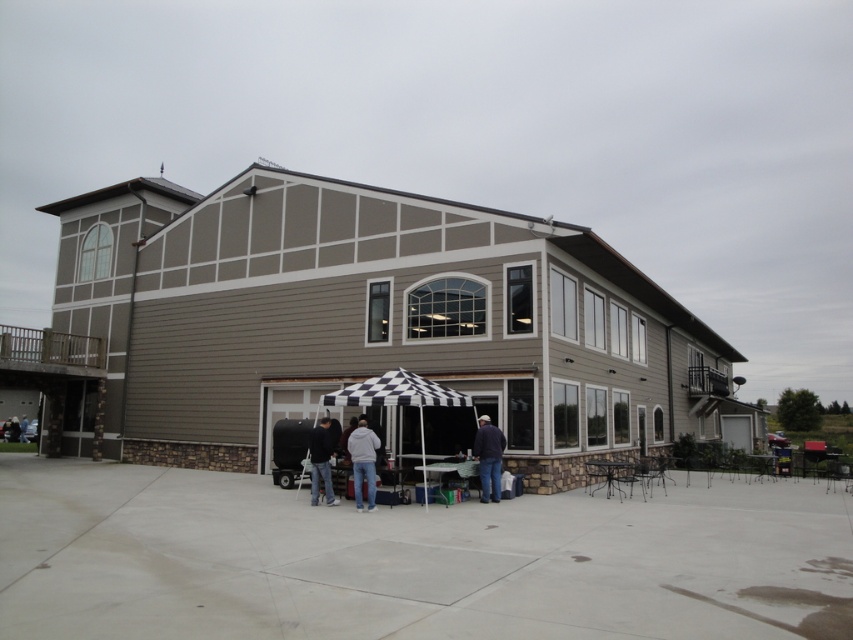
Is dark gray hoodie at lower center smaller than black fabric umbrella at center?

Incorrect, dark gray hoodie at lower center is not smaller in size than black fabric umbrella at center.

Is point (310, 436) less distant than point (10, 435)?

Yes, point (310, 436) is in front of point (10, 435).

I want to click on dark gray hoodie at lower center, so click(x=321, y=461).

Can you confirm if dark blue jacket at lower center is positioned to the right of black fabric person at lower left?

Indeed, dark blue jacket at lower center is positioned on the right side of black fabric person at lower left.

Between dark blue jacket at lower center and black fabric person at lower left, which one is positioned lower?

black fabric person at lower left is lower down.

The width and height of the screenshot is (853, 640). What do you see at coordinates (488, 458) in the screenshot?
I see `dark blue jacket at lower center` at bounding box center [488, 458].

Image resolution: width=853 pixels, height=640 pixels. I want to click on dark blue jacket at lower center, so click(488, 458).

Can you confirm if black checkered umbrella at center is wider than black fabric umbrella at center?

Indeed, black checkered umbrella at center has a greater width compared to black fabric umbrella at center.

Locate an element on the screen. black checkered umbrella at center is located at coordinates (398, 396).